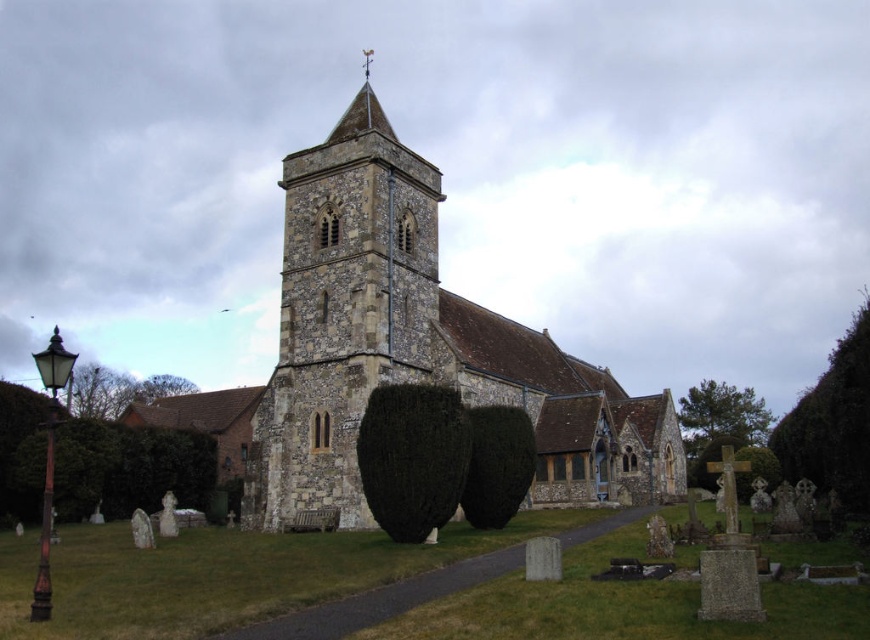
Can you confirm if stone tower at center is positioned to the left of green leafy hedge at right?

Yes, stone tower at center is to the left of green leafy hedge at right.

Can you confirm if stone tower at center is positioned below green leafy hedge at right?

No, stone tower at center is not below green leafy hedge at right.

I want to click on stone tower at center, so click(x=346, y=314).

Consider the image. Measure the distance between stone church at center and green leafy hedge at right.

stone church at center and green leafy hedge at right are 102.34 feet apart from each other.

Identify the location of stone church at center. This screenshot has width=870, height=640. (417, 346).

Between point (379, 365) and point (837, 412), which one is positioned in front?

Point (837, 412) is in front.

Image resolution: width=870 pixels, height=640 pixels. Find the location of `stone church at center`. stone church at center is located at coordinates (417, 346).

Who is more forward, (357, 170) or (410, 444)?

Point (410, 444) is more forward.

Can you confirm if stone church at center is thinner than dark green bush at center?

In fact, stone church at center might be wider than dark green bush at center.

Where is `stone church at center`? The height and width of the screenshot is (640, 870). stone church at center is located at coordinates (417, 346).